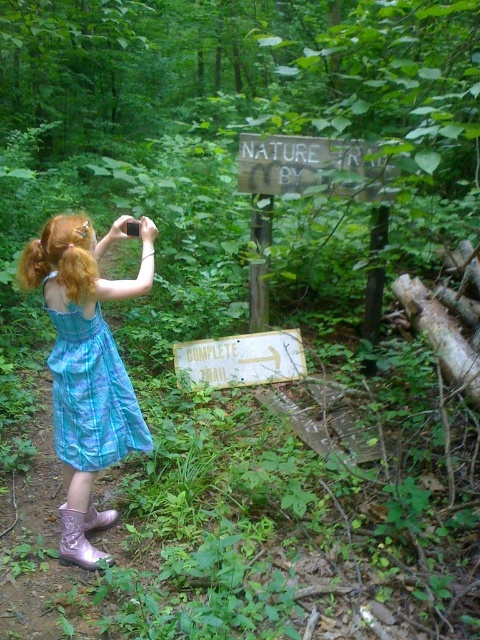
You are a photographer trying to frame the scene. The shiny blue dress at center and the blonde silky hair at left are both in your shot. Which object should you adjust to ensure the frame isn not too crowded?

Since the shiny blue dress at center might be wider than blonde silky hair at left, you should adjust the shiny blue dress at center to prevent overcrowding the frame.

From the picture: The girl in the image is wearing a shiny blue dress at center and has blonde silky hair at left. Which of these two items is bigger in size?

The shiny blue dress at center has a larger size compared to the blonde silky hair at left.

You are a photographer trying to capture the shiny blue dress at center and the weathered wood sign at upper center in the same frame. Based on their positions, which object should you focus on first to ensure both are in focus?

The shiny blue dress at center is closer to the viewer than the weathered wood sign at upper center. To ensure both are in focus, you should focus on the shiny blue dress at center first, as it is the closer object.